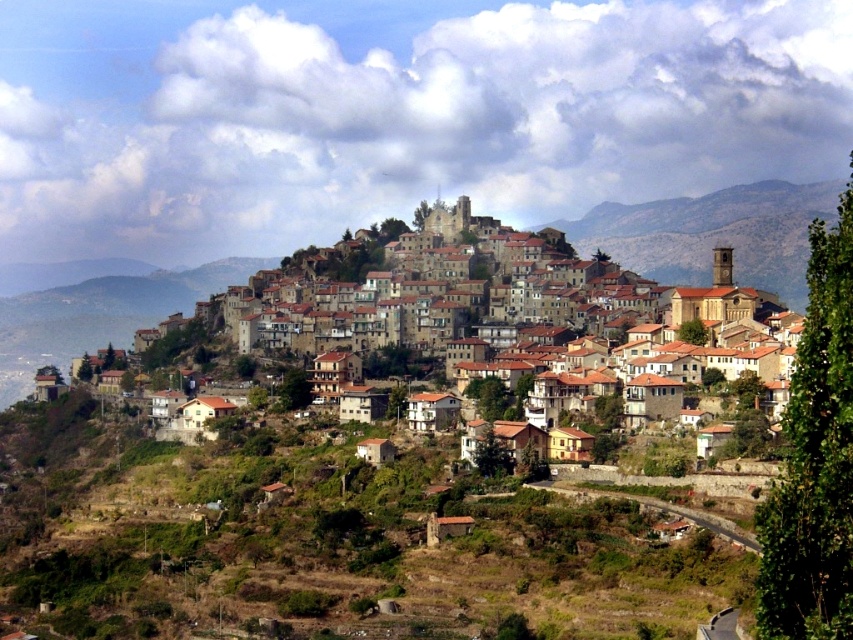
Question: Which of the following is the closest to the observer?

Choices:
 (A) brown rocky mountain at center
 (B) brown stone buildings at center

Answer: (A)

Question: Can you confirm if brown stone buildings at center is positioned below brown rocky mountain at center?

Choices:
 (A) no
 (B) yes

Answer: (B)

Question: Is brown stone buildings at center to the right of brown rocky mountain at center from the viewer's perspective?

Choices:
 (A) yes
 (B) no

Answer: (B)

Question: Does brown stone buildings at center appear on the left side of brown rocky mountain at center?

Choices:
 (A) no
 (B) yes

Answer: (B)